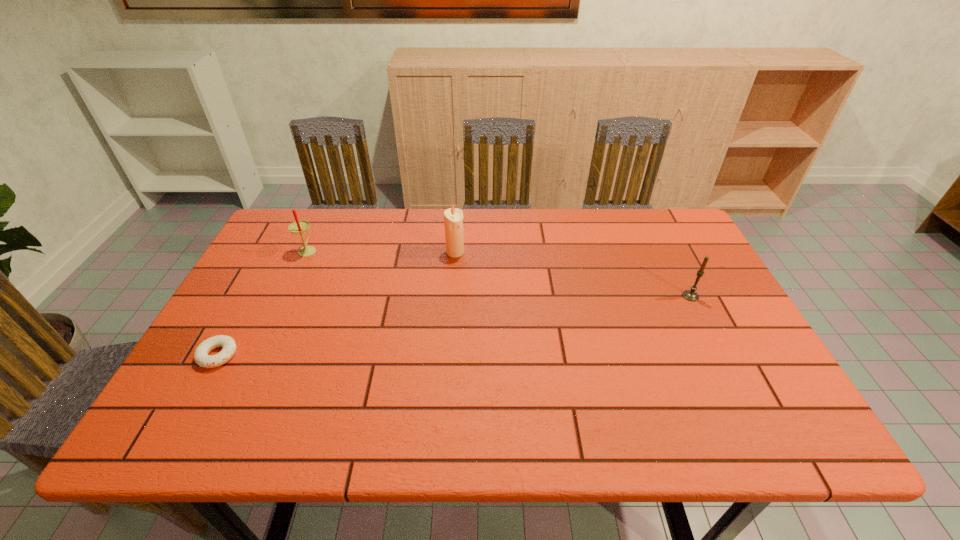
Image resolution: width=960 pixels, height=540 pixels. I want to click on free space between the leftmost candle and the nearest candle, so [x=499, y=273].

This screenshot has width=960, height=540. I want to click on vacant point located between the third object from right to left and the shortest object, so click(x=263, y=302).

Find the location of a particular element. free space between the third farthest object and the second object from left to right is located at coordinates (499, 273).

Locate an element on the screen. This screenshot has height=540, width=960. empty space between the rightmost candle and the second candle from right to left is located at coordinates (573, 274).

The image size is (960, 540). Identify the location of free space between the second object from left to right and the third object from left to right. (381, 251).

Find the location of a particular element. blank region between the leftmost object and the third object from right to left is located at coordinates (263, 302).

This screenshot has height=540, width=960. Find the location of `free spot between the nearest object and the second candle from left to right`. free spot between the nearest object and the second candle from left to right is located at coordinates (337, 304).

Image resolution: width=960 pixels, height=540 pixels. Find the location of `unoccupied position between the second object from left to right and the rightmost candle`. unoccupied position between the second object from left to right and the rightmost candle is located at coordinates (499, 273).

Where is `free point between the third object from right to left and the shortest object`? The image size is (960, 540). free point between the third object from right to left and the shortest object is located at coordinates (263, 302).

The width and height of the screenshot is (960, 540). I want to click on object that is the second nearest to the second candle from left to right, so click(x=201, y=357).